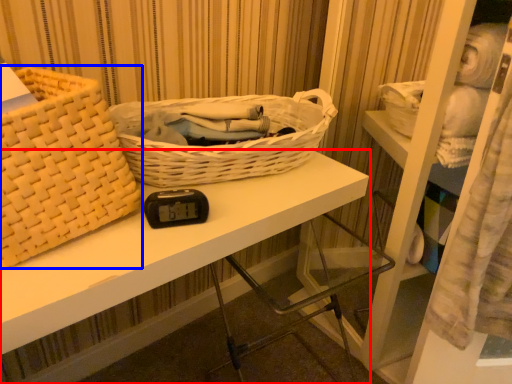
Question: Which of the following is the closest to the observer, desk (highlighted by a red box) or picnic basket (highlighted by a blue box)?

Choices:
 (A) desk
 (B) picnic basket

Answer: (B)